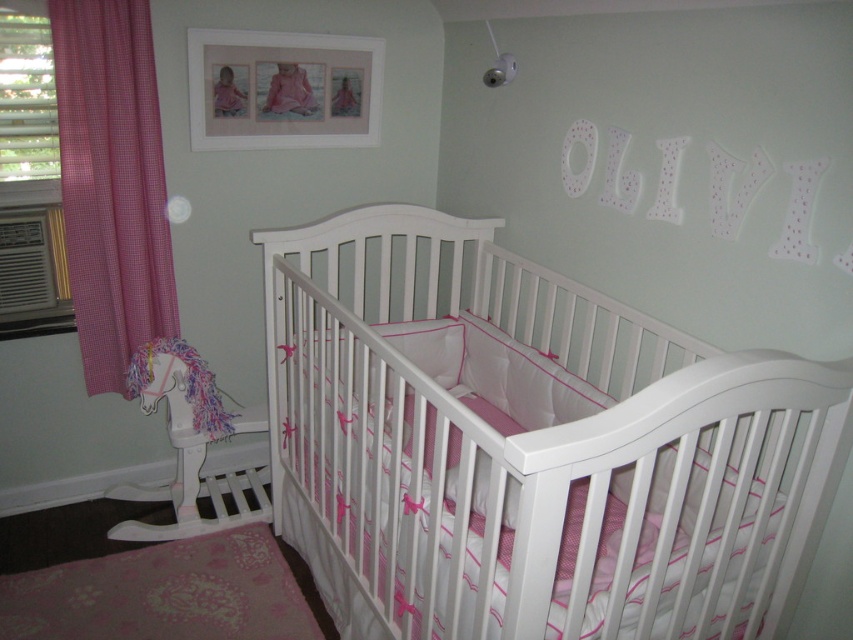
Question: Among these points, which one is farthest from the camera?

Choices:
 (A) (405, 284)
 (B) (61, 26)
 (C) (229, 77)

Answer: (A)

Question: Which of the following is the farthest from the observer?

Choices:
 (A) (221, 112)
 (B) (77, 260)
 (C) (372, 76)
 (D) (595, 451)

Answer: (C)

Question: Is pink gingham curtain at left bigger than pink fabric baby at upper center?

Choices:
 (A) no
 (B) yes

Answer: (B)

Question: Can you confirm if white glossy crib at center is bigger than pink gingham curtain at left?

Choices:
 (A) no
 (B) yes

Answer: (B)

Question: Is white glossy crib at center bigger than pink gingham curtain at left?

Choices:
 (A) yes
 (B) no

Answer: (A)

Question: Which point is closer to the camera?

Choices:
 (A) pink gingham curtain at left
 (B) white matte picture frame at upper center
 (C) pink fabric baby at upper center

Answer: (A)